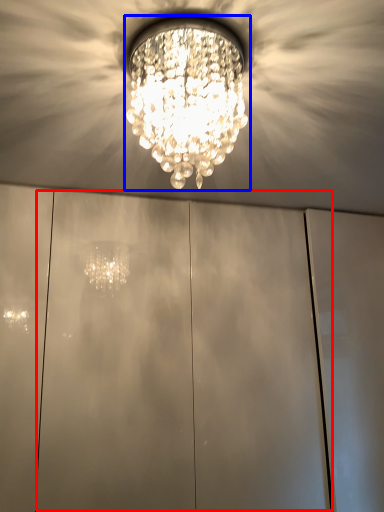
Question: Which of the following is the farthest to the observer, glass door (highlighted by a red box) or lamp (highlighted by a blue box)?

Choices:
 (A) glass door
 (B) lamp

Answer: (A)